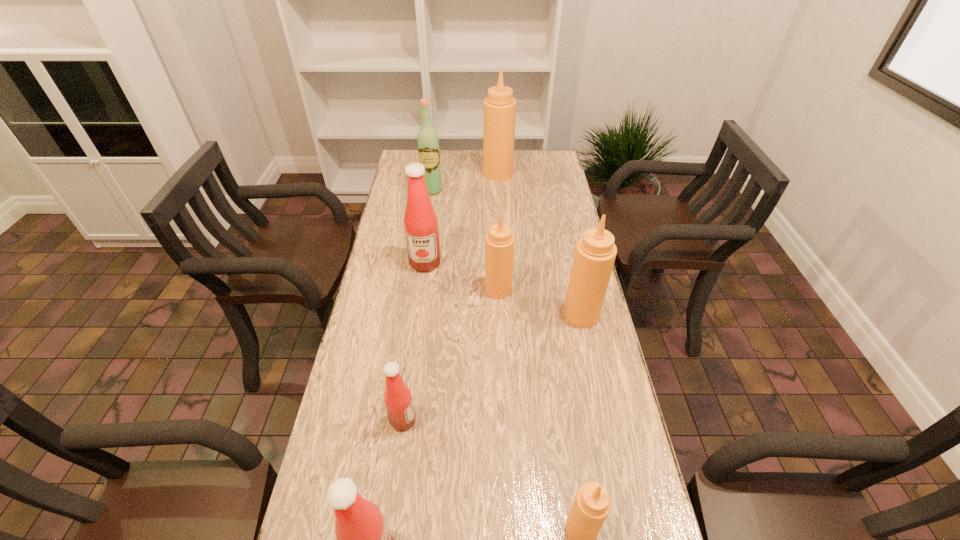
You are a GUI agent. You are given a task and a screenshot of the screen. Output one action in this format:
    pyautogui.click(x=<x>, y=<y>)
    Task: Click on the object that is positioned at the right edge
    This screenshot has height=540, width=960.
    Given the screenshot: What is the action you would take?
    pyautogui.click(x=595, y=253)

What are the coordinates of `vacant space at the far edge` in the screenshot? It's located at (517, 176).

You are a GUI agent. You are given a task and a screenshot of the screen. Output one action in this format:
    pyautogui.click(x=<x>, y=<y>)
    Task: Click on the vacant space at the left edge of the desktop
    Image resolution: width=960 pixels, height=540 pixels.
    Given the screenshot: What is the action you would take?
    pyautogui.click(x=383, y=330)

Find the location of a particular element. This screenshot has height=540, width=960. vacant space at the far right corner of the desktop is located at coordinates (541, 154).

What are the coordinates of `vacant region between the third nearest condiment and the fourth farthest object` in the screenshot? It's located at (450, 355).

Image resolution: width=960 pixels, height=540 pixels. In order to click on free space between the sixth farthest object and the third biggest tan condiment in this screenshot , I will do `click(450, 355)`.

You are a GUI agent. You are given a task and a screenshot of the screen. Output one action in this format:
    pyautogui.click(x=<x>, y=<y>)
    Task: Click on the vacant point located between the fifth nearest condiment and the farthest red condiment
    The image size is (960, 540).
    Given the screenshot: What is the action you would take?
    pyautogui.click(x=462, y=276)

Locate an element on the screen. The width and height of the screenshot is (960, 540). unoccupied area between the biggest tan condiment and the biggest red condiment is located at coordinates (462, 218).

Where is `object that stands as the third closest to the nearest red condiment`? The image size is (960, 540). object that stands as the third closest to the nearest red condiment is located at coordinates (499, 242).

The height and width of the screenshot is (540, 960). Find the location of `the fourth closest object relative to the nearest tan condiment`. the fourth closest object relative to the nearest tan condiment is located at coordinates (499, 242).